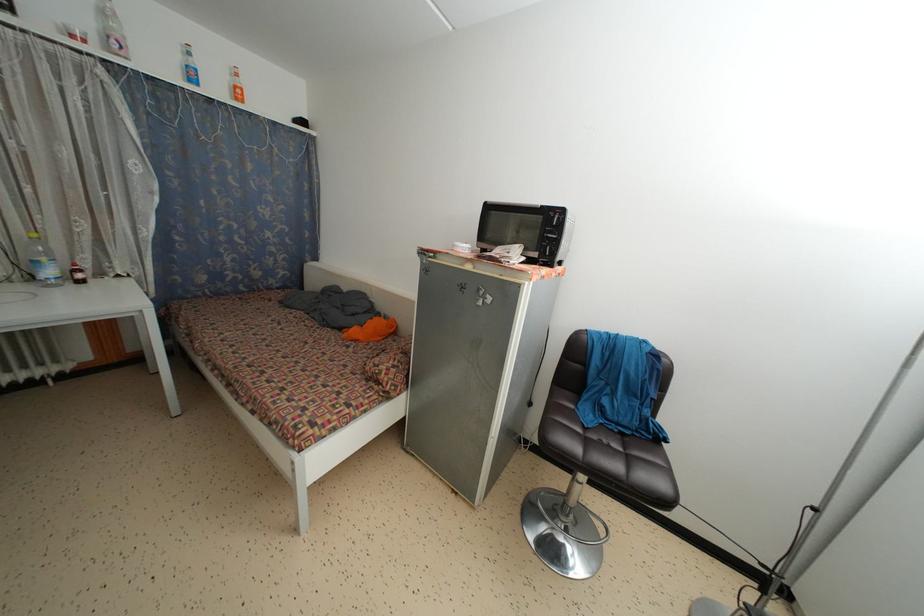
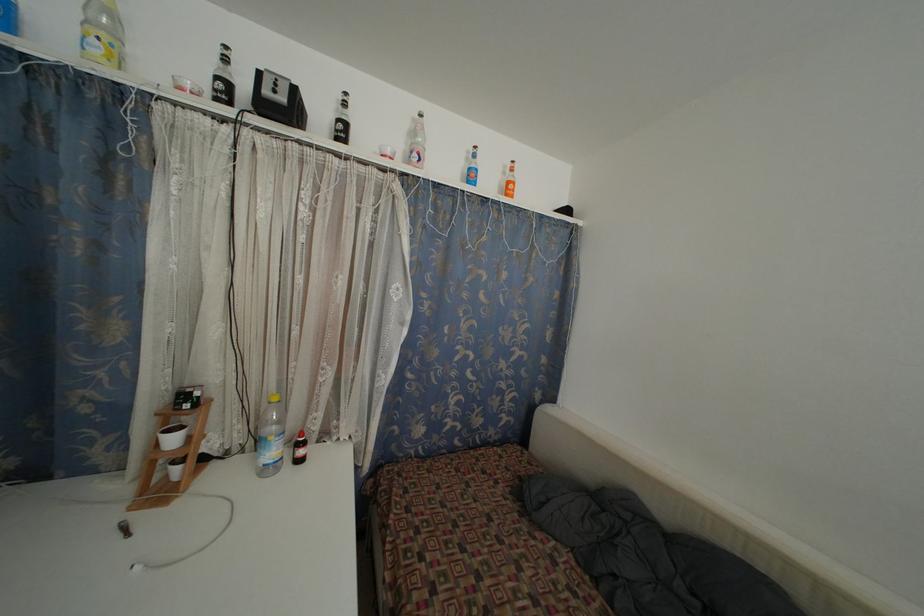
In the second image, find the point that corresponds to [83,282] in the first image.

(305, 458)